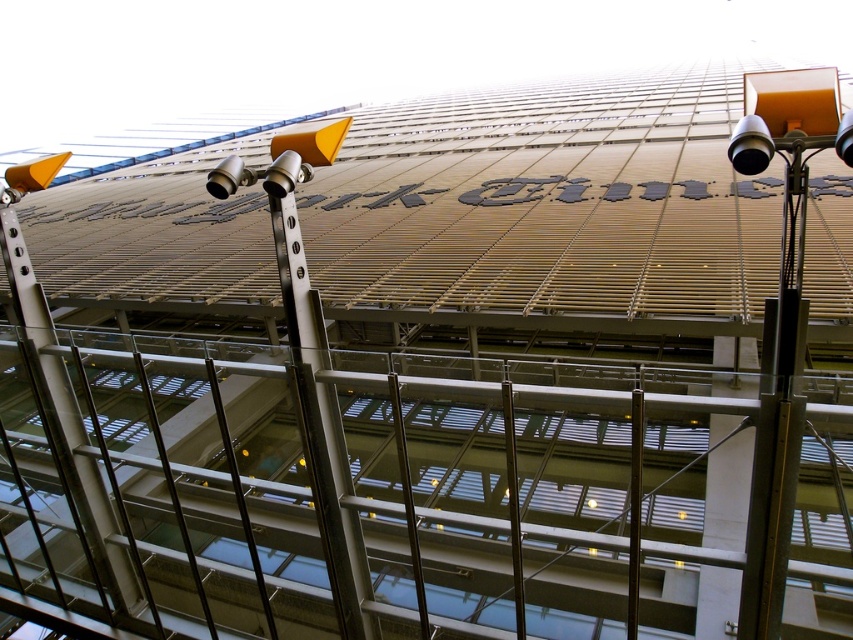
Question: Does black metal pole at center appear on the left side of polished silver pole at center?

Choices:
 (A) yes
 (B) no

Answer: (B)

Question: Can you confirm if black metal pole at center is smaller than polished silver pole at center?

Choices:
 (A) yes
 (B) no

Answer: (A)

Question: Which point appears farthest from the camera in this image?

Choices:
 (A) (634, 602)
 (B) (520, 561)

Answer: (B)

Question: Which of the following is the farthest from the observer?

Choices:
 (A) (630, 492)
 (B) (517, 508)

Answer: (A)

Question: Is black metal pole at center thinner than polished silver pole at center?

Choices:
 (A) yes
 (B) no

Answer: (A)